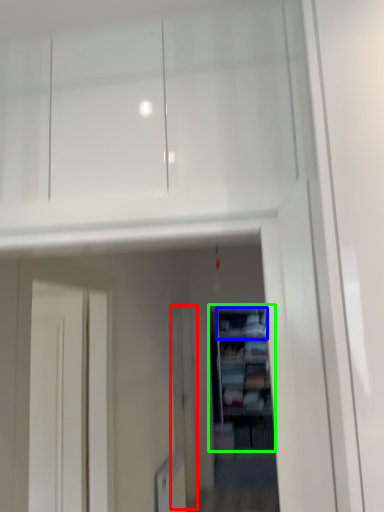
Question: Which object is the closest to the screen door (highlighted by a red box)? Choose among these: cabinet (highlighted by a blue box) or shelf (highlighted by a green box).

Choices:
 (A) cabinet
 (B) shelf

Answer: (B)